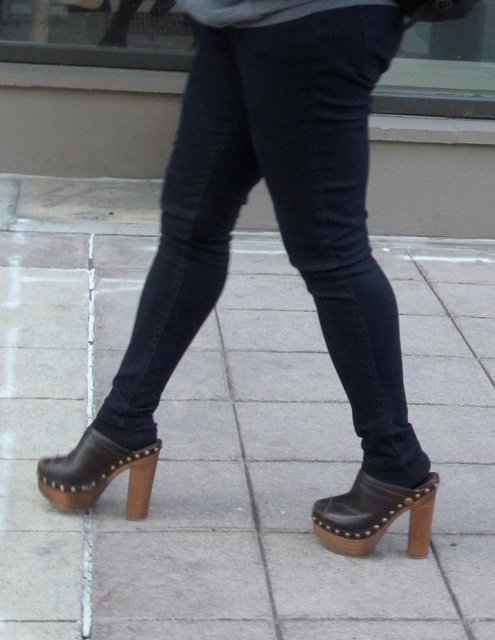
You are a fashion designer trying to create a new line of footwear that complements the dark blue denim jeans at center. Based on the image, can you determine if the brown leather clogs at lower center would fit comfortably next to the jeans in terms of width?

The brown leather clogs at lower center might be wider than dark blue denim jeans at center, so they could provide a stylish contrast in width while maintaining a cohesive look.

You are a fashion designer analyzing the placement of clothing items in the image. Which item is positioned higher on the person, the dark blue denim jeans at center or the brown leather clog at lower right?

The dark blue denim jeans at center is above the brown leather clog at lower right, so the dark blue denim jeans at center is positioned higher on the person.

You are taking a photo of the scene described. You want to focus on the point that is closer to the camera. Which point should you choose between point (11, 570) and point (283, 115)?

Point (283, 115) is closer to the camera than point (11, 570), so you should focus on point (283, 115) to capture the closer one.